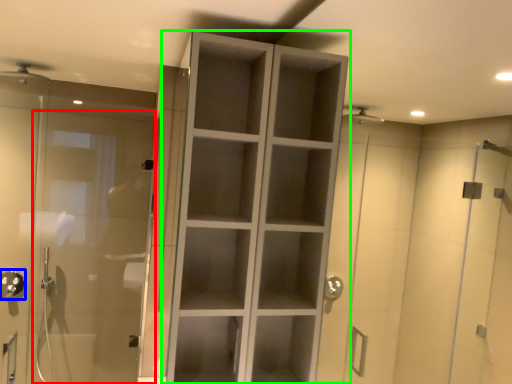
Question: Considering the real-world distances, which object is closest to door (highlighted by a red box)? shower (highlighted by a blue box) or cupboard (highlighted by a green box).

Choices:
 (A) shower
 (B) cupboard

Answer: (A)